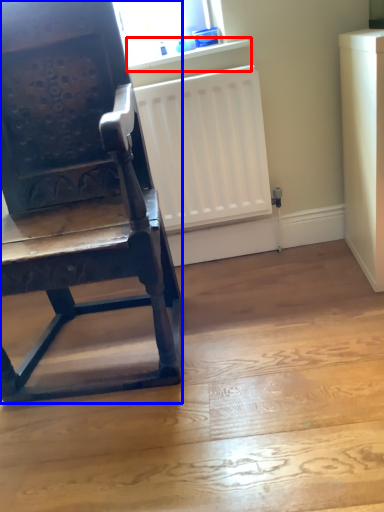
Question: Which object is further to the camera taking this photo, window sill (highlighted by a red box) or chair (highlighted by a blue box)?

Choices:
 (A) window sill
 (B) chair

Answer: (A)